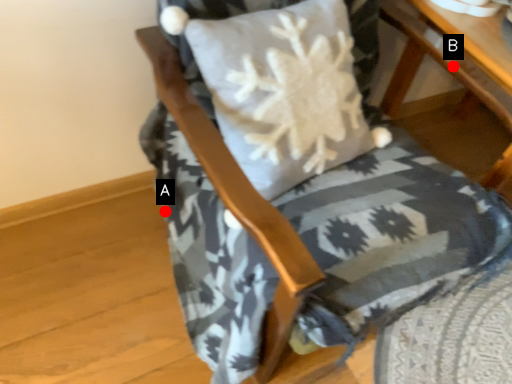
Question: Two points are circled on the image, labeled by A and B beside each circle. Which point is further to the camera?

Choices:
 (A) A is further
 (B) B is further

Answer: (A)